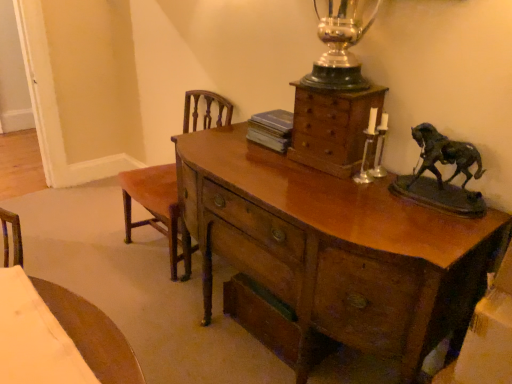
Question: From the image's perspective, is glossy wood desk at center located beneath brown wood chair at left?

Choices:
 (A) yes
 (B) no

Answer: (A)

Question: From a real-world perspective, is glossy wood desk at center on top of brown wood chair at left?

Choices:
 (A) yes
 (B) no

Answer: (B)

Question: Is glossy wood desk at center facing towards brown wood chair at left?

Choices:
 (A) no
 (B) yes

Answer: (A)

Question: Is glossy wood desk at center not close to brown wood chair at left?

Choices:
 (A) no
 (B) yes

Answer: (A)

Question: Does glossy wood desk at center appear on the right side of brown wood chair at left?

Choices:
 (A) yes
 (B) no

Answer: (A)

Question: From the image's perspective, is glossy wood desk at center on top of brown wood chair at left?

Choices:
 (A) no
 (B) yes

Answer: (A)

Question: From the image's perspective, is glossy wood desk at center below wooden chest of drawers at upper center?

Choices:
 (A) no
 (B) yes

Answer: (B)

Question: Is glossy wood desk at center not close to wooden chest of drawers at upper center?

Choices:
 (A) no
 (B) yes

Answer: (A)

Question: Is glossy wood desk at center positioned with its back to wooden chest of drawers at upper center?

Choices:
 (A) no
 (B) yes

Answer: (A)

Question: Does glossy wood desk at center turn towards wooden chest of drawers at upper center?

Choices:
 (A) no
 (B) yes

Answer: (A)

Question: Does glossy wood desk at center lie behind wooden chest of drawers at upper center?

Choices:
 (A) no
 (B) yes

Answer: (A)

Question: Are glossy wood desk at center and wooden chest of drawers at upper center making contact?

Choices:
 (A) yes
 (B) no

Answer: (B)

Question: From the image's perspective, is wooden chest of drawers at upper center located beneath glossy wood desk at center?

Choices:
 (A) yes
 (B) no

Answer: (B)